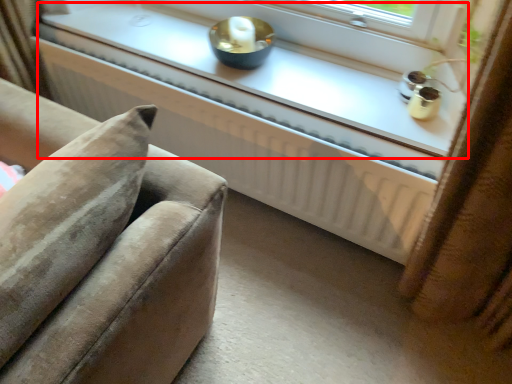
Question: Observing the image, what is the correct spatial positioning of window sill (annotated by the red box) in reference to radiator?

Choices:
 (A) left
 (B) right

Answer: (B)